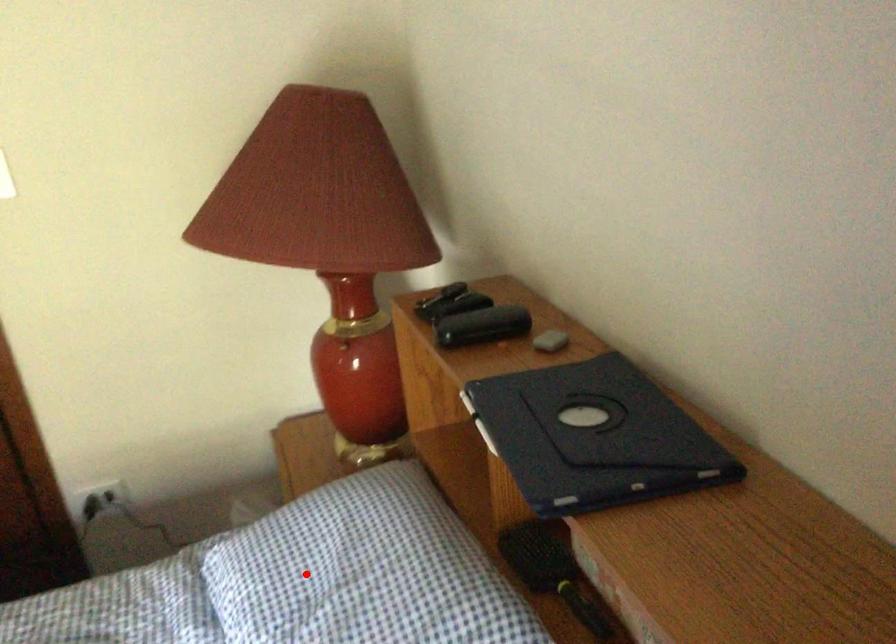
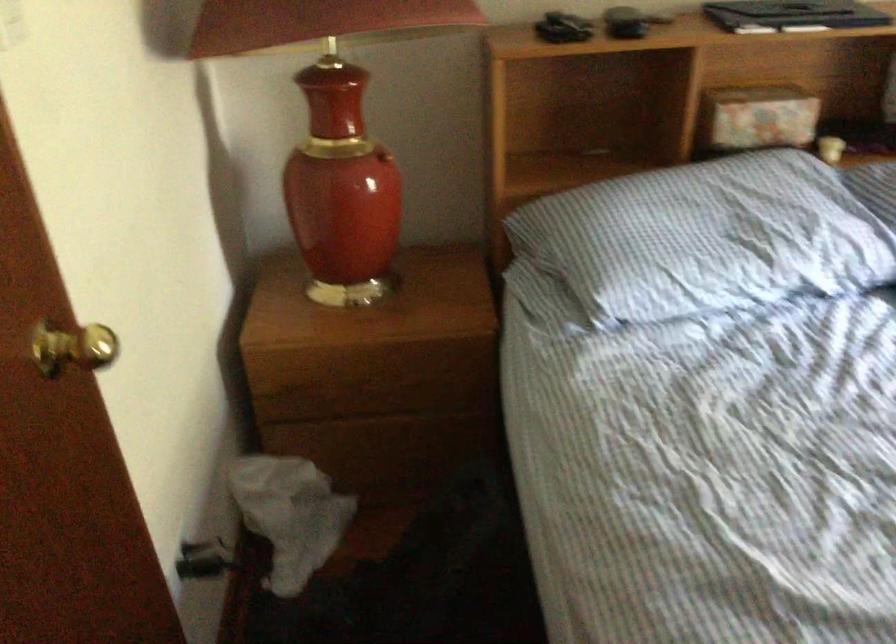
Find the pixel in the second image that matches the highlighted location in the first image.

(707, 238)